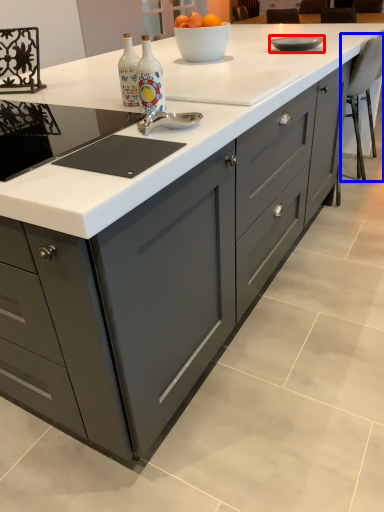
Question: Which point is further to the camera, bowl (highlighted by a red box) or chair (highlighted by a blue box)?

Choices:
 (A) bowl
 (B) chair

Answer: (B)